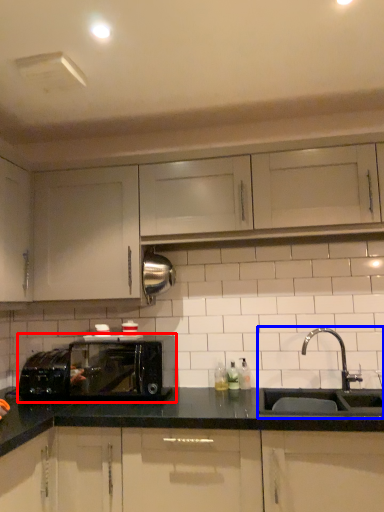
Question: Which point is closer to the camera, microwave oven (highlighted by a red box) or sink (highlighted by a blue box)?

Choices:
 (A) microwave oven
 (B) sink

Answer: (B)